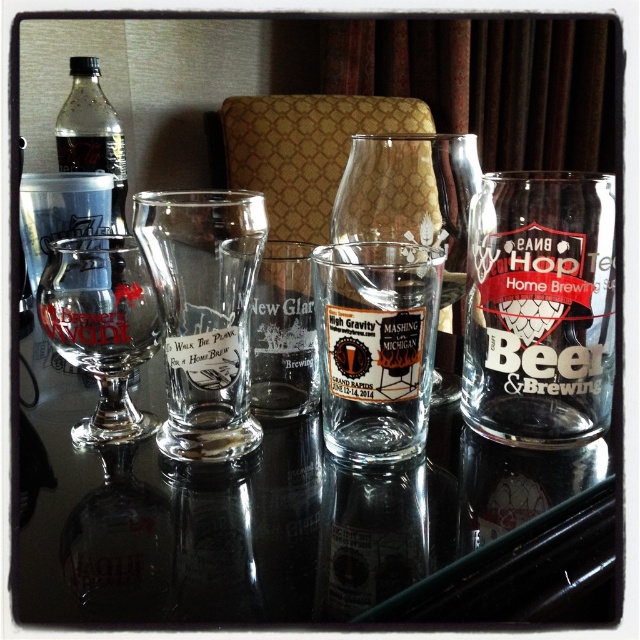
Question: Does transparent glass at center have a lesser width compared to translucent plastic bottle at upper left?

Choices:
 (A) yes
 (B) no

Answer: (B)

Question: Does clear glass beer mug at center have a larger size compared to clear glass wine glass at left?

Choices:
 (A) yes
 (B) no

Answer: (A)

Question: Which object appears farthest from the camera in this image?

Choices:
 (A) transparent glass at center
 (B) translucent plastic bottle at upper left
 (C) clear glass shot glass at center

Answer: (B)

Question: Which of these objects is positioned closest to the clear glass shot glass at center?

Choices:
 (A) clear glass beer glass at center
 (B) clear glass beer mug at center
 (C) transparent glass at center
 (D) translucent plastic bottle at upper left

Answer: (C)

Question: Can you confirm if clear glass beer glass at center is wider than clear glass wine glass at left?

Choices:
 (A) yes
 (B) no

Answer: (A)

Question: Among these points, which one is nearest to the camera?

Choices:
 (A) (x=134, y=436)
 (B) (x=344, y=268)

Answer: (B)